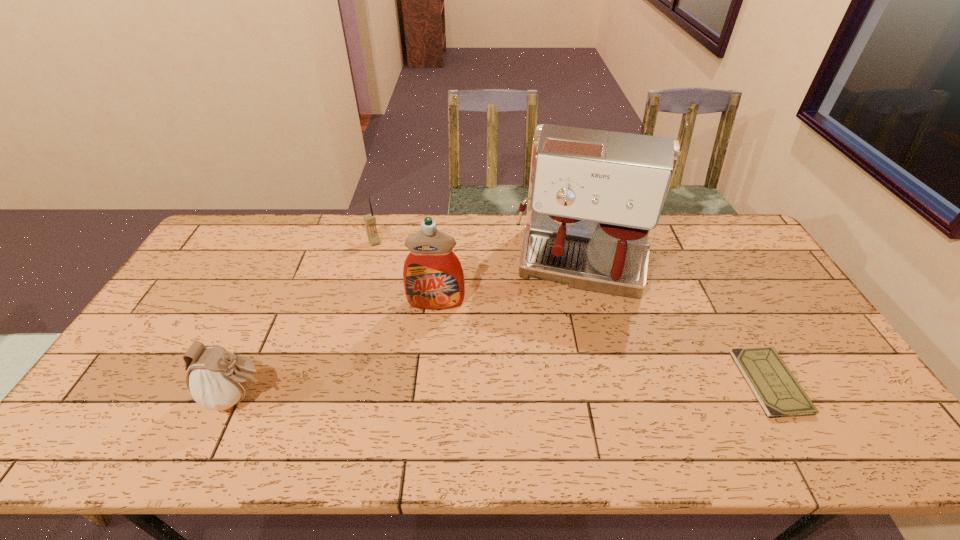
Locate an element on the screen. coffee maker that is at the far edge is located at coordinates (595, 197).

Identify the location of pouch situated at the near edge. (218, 379).

Identify the location of checkbook present at the near edge. (778, 392).

This screenshot has width=960, height=540. I want to click on object at the right edge, so click(x=778, y=392).

The width and height of the screenshot is (960, 540). I want to click on object at the near right corner, so click(778, 392).

Identify the location of free space at the far edge of the desktop. (332, 235).

Image resolution: width=960 pixels, height=540 pixels. I want to click on free point at the near edge, so click(619, 388).

This screenshot has height=540, width=960. I want to click on free spot at the left edge of the desktop, so (x=229, y=261).

Find the location of a particular element. Image resolution: width=960 pixels, height=540 pixels. vacant space at the right edge of the desktop is located at coordinates (735, 272).

In the image, there is a desktop. Identify the location of vacant area at the far left corner. (249, 216).